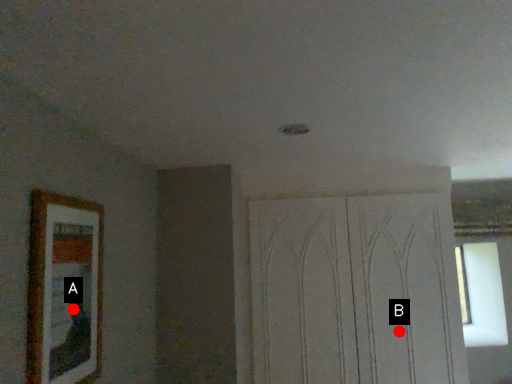
Question: Two points are circled on the image, labeled by A and B beside each circle. Which point appears farthest from the camera in this image?

Choices:
 (A) A is further
 (B) B is further

Answer: (B)